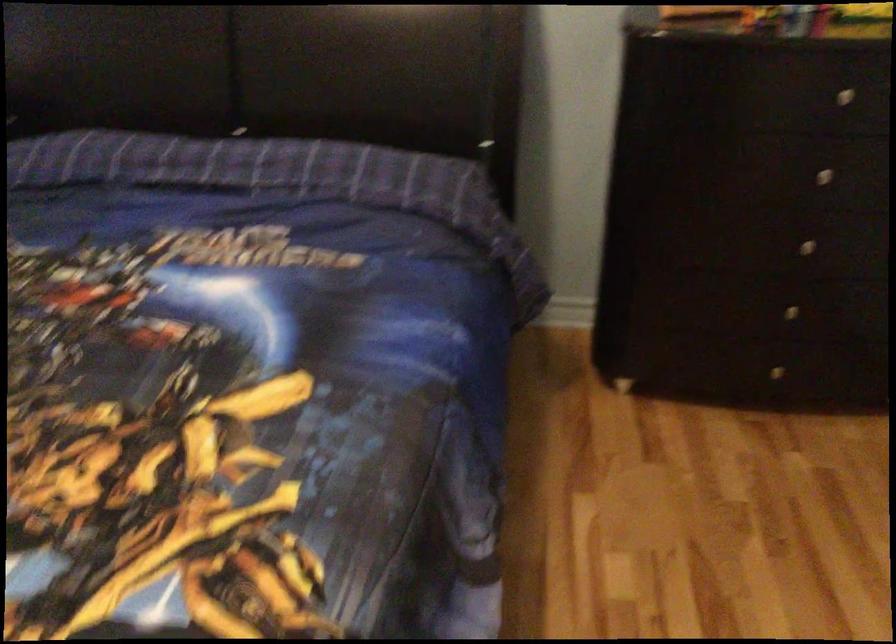
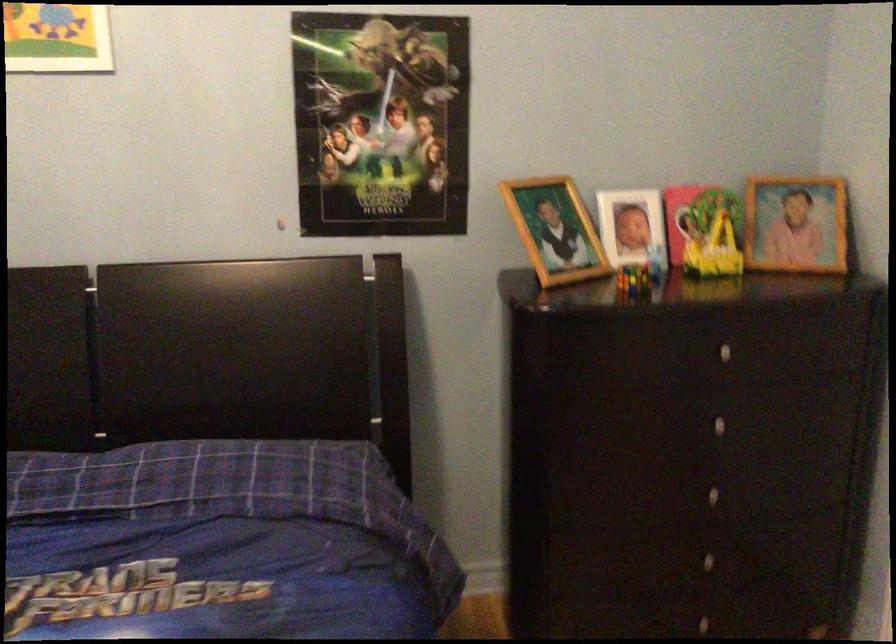
The images are taken continuously from a first-person perspective. In which direction are you moving?

The movement direction of the cameraman is left, forward.